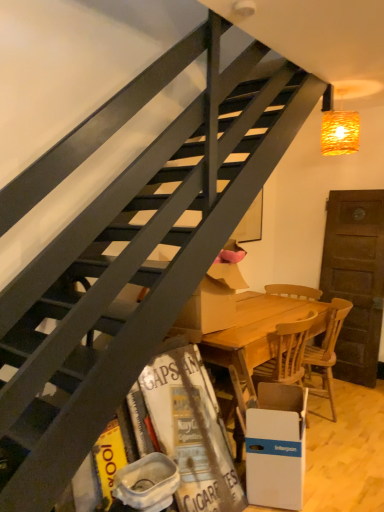
The height and width of the screenshot is (512, 384). In order to click on wooden at lower right, the 2th chair viewed from the left in this screenshot , I will do `click(325, 354)`.

What do you see at coordinates (340, 132) in the screenshot?
I see `woven glass lampshade at upper right` at bounding box center [340, 132].

Locate an element on the screen. white plastic trash bin/can at lower center is located at coordinates (147, 483).

Identify the location of wooden at lower right, which appears as the 1th chair when viewed from the right. (325, 354).

From a real-world perspective, which object rests below the other?

wooden at under stairs, the 2th chair in the right-to-left sequence, from a real-world perspective.

How different are the orientations of woven glass lampshade at upper right and wooden at under stairs, the 2th chair in the right-to-left sequence, in degrees?

The angular difference between woven glass lampshade at upper right and wooden at under stairs, the 2th chair in the right-to-left sequence, is 90 degrees.

Is woven glass lampshade at upper right not close to wooden at under stairs, which is the first chair in left-to-right order?

woven glass lampshade at upper right is positioned a significant distance from wooden at under stairs, which is the first chair in left-to-right order.

Considering the sizes of objects woven glass lampshade at upper right and wooden at under stairs, the 2th chair in the right-to-left sequence, in the image provided, who is wider, woven glass lampshade at upper right or wooden at under stairs, the 2th chair in the right-to-left sequence,?

With larger width is wooden at under stairs, the 2th chair in the right-to-left sequence.

Is wooden at under stairs, the 2th chair in the right-to-left sequence, facing away from wooden at lower right, which appears as the 1th chair when viewed from the right?

wooden at under stairs, the 2th chair in the right-to-left sequence, does not have its back to wooden at lower right, which appears as the 1th chair when viewed from the right.

Between wooden at under stairs, the 2th chair in the right-to-left sequence, and wooden at lower right, which appears as the 1th chair when viewed from the right, which one appears on the right side from the viewer's perspective?

wooden at lower right, which appears as the 1th chair when viewed from the right, is more to the right.

Locate an element on the screen. Image resolution: width=384 pixels, height=512 pixels. chair located behind the wooden at under stairs, which is the first chair in left-to-right order is located at coordinates (325, 354).

Is wooden at under stairs, which is the first chair in left-to-right order, not within wooden at lower right, which appears as the 1th chair when viewed from the right?

Absolutely, wooden at under stairs, which is the first chair in left-to-right order, is external to wooden at lower right, which appears as the 1th chair when viewed from the right.

Is white cardboard box at lower right bigger or smaller than wooden at lower right, which appears as the 1th chair when viewed from the right?

Clearly, white cardboard box at lower right is smaller in size than wooden at lower right, which appears as the 1th chair when viewed from the right.

Is white cardboard box at lower right spatially inside wooden at lower right, which appears as the 1th chair when viewed from the right, or outside of it?

white cardboard box at lower right is not inside wooden at lower right, which appears as the 1th chair when viewed from the right, it's outside.

This screenshot has width=384, height=512. Find the location of `chair that is the 1st object above the white cardboard box at lower right (from a real-world perspective)`. chair that is the 1st object above the white cardboard box at lower right (from a real-world perspective) is located at coordinates (325, 354).

Which of these two, white cardboard box at lower right or wooden at lower right, which appears as the 1th chair when viewed from the right, is thinner?

white cardboard box at lower right is thinner.

Between white plastic trash bin/can at lower center and wooden at under stairs, the 2th chair in the right-to-left sequence, which one is positioned in front?

white plastic trash bin/can at lower center is in front.

Are white plastic trash bin/can at lower center and wooden at under stairs, the 2th chair in the right-to-left sequence, far apart?

That's not correct — white plastic trash bin/can at lower center is a little close to wooden at under stairs, the 2th chair in the right-to-left sequence.

From the image's perspective, is white plastic trash bin/can at lower center positioned above or below wooden at under stairs, which is the first chair in left-to-right order?

white plastic trash bin/can at lower center is situated lower than wooden at under stairs, which is the first chair in left-to-right order, in the image.

Looking at the image, does white plastic trash bin/can at lower center seem bigger or smaller compared to wooden at under stairs, the 2th chair in the right-to-left sequence?

In the image, white plastic trash bin/can at lower center appears to be smaller than wooden at under stairs, the 2th chair in the right-to-left sequence.

Which is more to the left, wooden at lower right, the 2th chair viewed from the left, or wooden at under stairs, the 2th chair in the right-to-left sequence?

wooden at under stairs, the 2th chair in the right-to-left sequence, is more to the left.

Can you confirm if wooden at lower right, which appears as the 1th chair when viewed from the right, is shorter than wooden at under stairs, the 2th chair in the right-to-left sequence?

Indeed, wooden at lower right, which appears as the 1th chair when viewed from the right, has a lesser height compared to wooden at under stairs, the 2th chair in the right-to-left sequence.

Is wooden at lower right, the 2th chair viewed from the left, facing towards wooden at under stairs, which is the first chair in left-to-right order?

No, wooden at lower right, the 2th chair viewed from the left, is not turned towards wooden at under stairs, which is the first chair in left-to-right order.

Is wooden at lower right, which appears as the 1th chair when viewed from the right, situated inside wooden at under stairs, the 2th chair in the right-to-left sequence, or outside?

wooden at lower right, which appears as the 1th chair when viewed from the right, lies outside wooden at under stairs, the 2th chair in the right-to-left sequence.

From the woven glass lampshade at upper right, count the 2nd chair to the left and point to it. Please provide its 2D coordinates.

[(287, 353)]

Is wooden at under stairs, which is the first chair in left-to-right order, next to woven glass lampshade at upper right and touching it?

No, wooden at under stairs, which is the first chair in left-to-right order, is not with woven glass lampshade at upper right.

Is point (296, 341) farther from camera compared to point (351, 130)?

That is False.

Is wooden at under stairs, which is the first chair in left-to-right order, inside the boundaries of woven glass lampshade at upper right, or outside?

wooden at under stairs, which is the first chair in left-to-right order, cannot be found inside woven glass lampshade at upper right.

Between white cardboard box at lower right and woven glass lampshade at upper right, which one has smaller size?

woven glass lampshade at upper right.

Is white cardboard box at lower right located outside woven glass lampshade at upper right?

Yes, white cardboard box at lower right is located beyond the bounds of woven glass lampshade at upper right.

Can you tell me how much white cardboard box at lower right and woven glass lampshade at upper right differ in facing direction?

The angular difference between white cardboard box at lower right and woven glass lampshade at upper right is 110 degrees.

Locate an element on the screen. box on the left of the woven glass lampshade at upper right is located at coordinates (276, 446).

At what (x,y) coordinates should I click in order to perform the action: click on lamp above the wooden at under stairs, which is the first chair in left-to-right order (from a real-world perspective). Please return your answer as a coordinate pair (x, y). Looking at the image, I should click on click(x=340, y=132).

Locate an element on the screen. This screenshot has width=384, height=512. chair located on the left of wooden at lower right, the 2th chair viewed from the left is located at coordinates (287, 353).

Looking at the image, which one is located further to woven glass lampshade at upper right, wooden at under stairs, which is the first chair in left-to-right order, or wooden at lower right, which appears as the 1th chair when viewed from the right?

wooden at under stairs, which is the first chair in left-to-right order.

When comparing their distances from white plastic trash bin/can at lower center, does white cardboard box at lower right or woven glass lampshade at upper right seem closer?

Based on the image, white cardboard box at lower right appears to be nearer to white plastic trash bin/can at lower center.

Considering their positions, is wooden at under stairs, which is the first chair in left-to-right order, positioned closer to white plastic trash bin/can at lower center than woven glass lampshade at upper right?

wooden at under stairs, which is the first chair in left-to-right order, is positioned closer to the anchor white plastic trash bin/can at lower center.

From the image, which object appears to be farther from wooden at lower right, the 2th chair viewed from the left, white plastic trash bin/can at lower center or wooden at under stairs, the 2th chair in the right-to-left sequence?

Based on the image, white plastic trash bin/can at lower center appears to be further to wooden at lower right, the 2th chair viewed from the left.

Estimate the real-world distances between objects in this image. Which object is closer to white plastic trash bin/can at lower center, wooden at lower right, which appears as the 1th chair when viewed from the right, or wooden at under stairs, which is the first chair in left-to-right order?

The object closer to white plastic trash bin/can at lower center is wooden at under stairs, which is the first chair in left-to-right order.

Which object lies further to the anchor point white cardboard box at lower right, woven glass lampshade at upper right or white plastic trash bin/can at lower center?

woven glass lampshade at upper right.

Which object lies nearer to the anchor point white cardboard box at lower right, white plastic trash bin/can at lower center or wooden at under stairs, the 2th chair in the right-to-left sequence?

The object closer to white cardboard box at lower right is wooden at under stairs, the 2th chair in the right-to-left sequence.

In the scene shown: When comparing their distances from woven glass lampshade at upper right, does wooden at under stairs, the 2th chair in the right-to-left sequence, or white plastic trash bin/can at lower center seem closer?

wooden at under stairs, the 2th chair in the right-to-left sequence, is positioned closer to the anchor woven glass lampshade at upper right.

Where is `chair that lies between woven glass lampshade at upper right and wooden at under stairs, which is the first chair in left-to-right order, from top to bottom`? chair that lies between woven glass lampshade at upper right and wooden at under stairs, which is the first chair in left-to-right order, from top to bottom is located at coordinates (325, 354).

At what (x,y) coordinates should I click in order to perform the action: click on chair between white plastic trash bin/can at lower center and wooden at lower right, which appears as the 1th chair when viewed from the right, in the front-back direction. Please return your answer as a coordinate pair (x, y). Looking at the image, I should click on pyautogui.click(x=287, y=353).

The image size is (384, 512). Identify the location of chair located between white cardboard box at lower right and wooden at lower right, the 2th chair viewed from the left, in the depth direction. (287, 353).

The width and height of the screenshot is (384, 512). What are the coordinates of `trash bin/can between woven glass lampshade at upper right and white cardboard box at lower right in the up-down direction` in the screenshot? It's located at (147, 483).